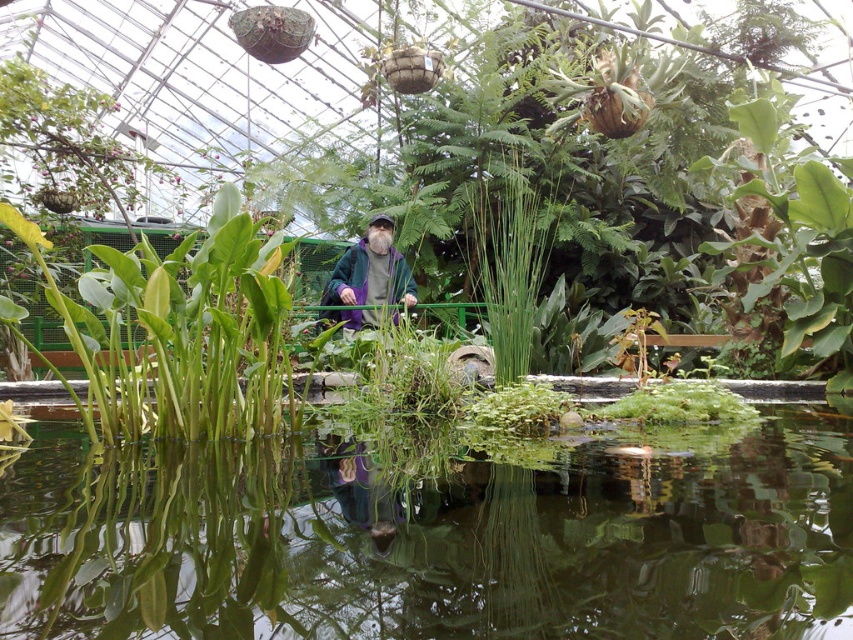
Can you confirm if transparent water at center is bigger than purple fabric jacket at center?

Yes.

Between transparent water at center and purple fabric jacket at center, which one appears on the right side from the viewer's perspective?

transparent water at center

What do you see at coordinates (433, 540) in the screenshot? The width and height of the screenshot is (853, 640). I see `transparent water at center` at bounding box center [433, 540].

Locate an element on the screen. This screenshot has height=640, width=853. transparent water at center is located at coordinates (433, 540).

Between transparent water at center and green leafy plant at center, which one appears on the left side from the viewer's perspective?

Positioned to the left is green leafy plant at center.

Which of these two, transparent water at center or green leafy plant at center, stands taller?

green leafy plant at center

The width and height of the screenshot is (853, 640). What do you see at coordinates (433, 540) in the screenshot?
I see `transparent water at center` at bounding box center [433, 540].

Where is `transparent water at center`? The height and width of the screenshot is (640, 853). transparent water at center is located at coordinates click(x=433, y=540).

You are a GUI agent. You are given a task and a screenshot of the screen. Output one action in this format:
    pyautogui.click(x=<x>, y=<y>)
    Task: Click on the green leafy plant at center
    
    Given the screenshot: What is the action you would take?
    pyautogui.click(x=178, y=330)

The height and width of the screenshot is (640, 853). I want to click on green leafy plant at center, so pos(178,330).